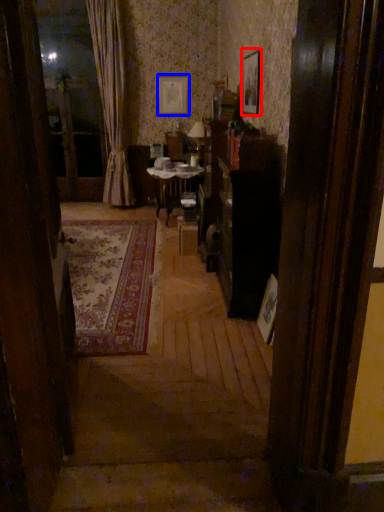
Question: Which point is further to the camera, picture frame (highlighted by a red box) or picture frame (highlighted by a blue box)?

Choices:
 (A) picture frame
 (B) picture frame

Answer: (B)